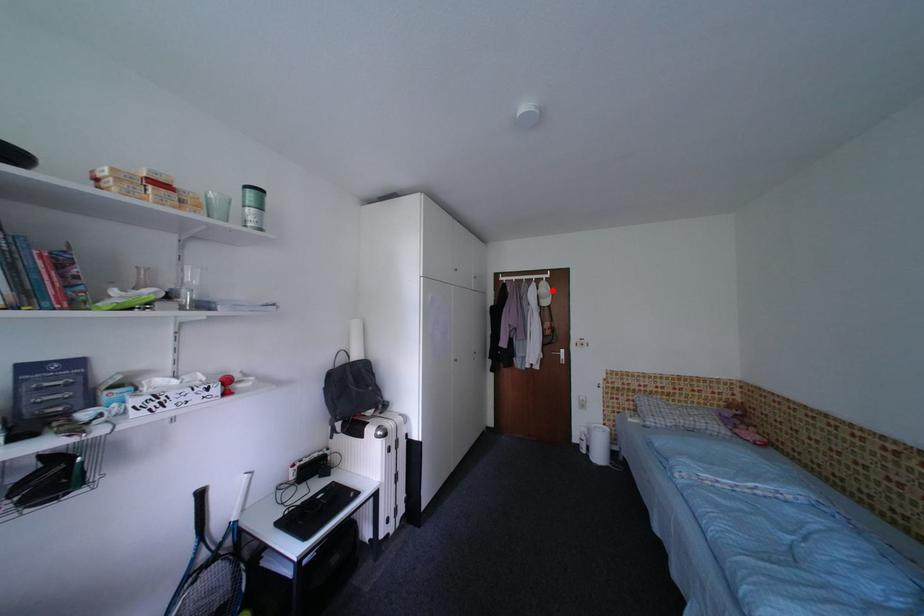
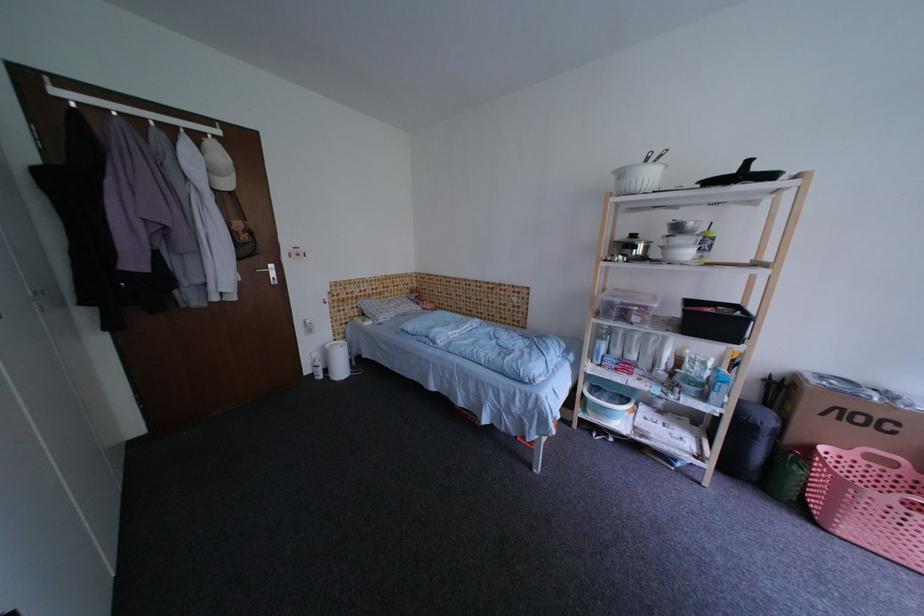
Find the pixel in the second image that matches the highlighted location in the first image.

(227, 158)